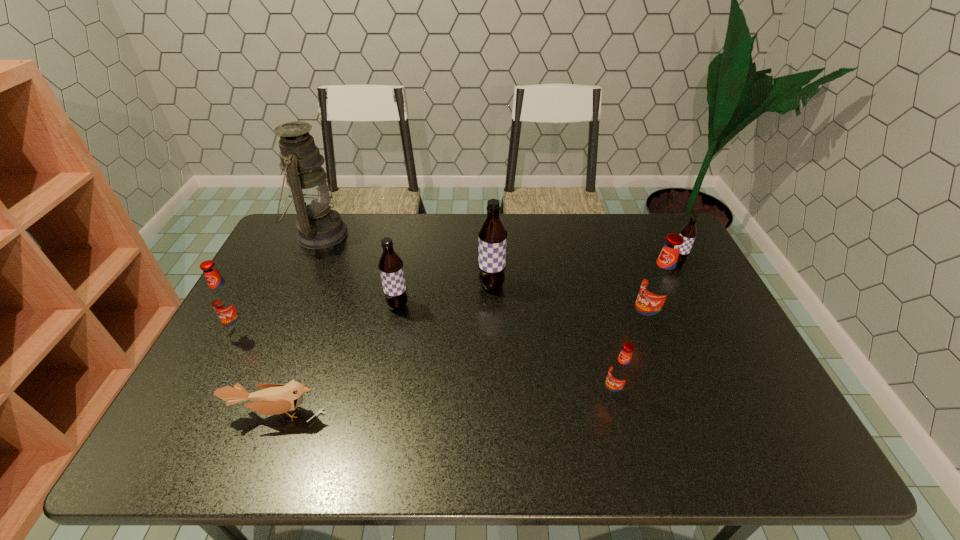
Choose which red root beer is the second nearest neighbor to the fourth root beer from right to left. Please provide its 2D coordinates. Your answer should be formatted as a tuple, i.e. [(x, y)], where the tuple contains the x and y coordinates of a point satisfying the conditions above.

[(620, 371)]

Identify which red root beer is the second closest to the fifth nearest root beer. Please provide its 2D coordinates. Your answer should be formatted as a tuple, i.e. [(x, y)], where the tuple contains the x and y coordinates of a point satisfying the conditions above.

[(620, 371)]

Where is `free location that satisfies the following two spatial constraints: 1. on the front side of the third farthest object; 2. on the left side of the smallest red root beer`? free location that satisfies the following two spatial constraints: 1. on the front side of the third farthest object; 2. on the left side of the smallest red root beer is located at coordinates (494, 394).

Find the location of a particular element. This screenshot has height=540, width=960. free location that satisfies the following two spatial constraints: 1. on the back side of the leftmost red root beer; 2. on the right side of the biggest brown root beer is located at coordinates (264, 286).